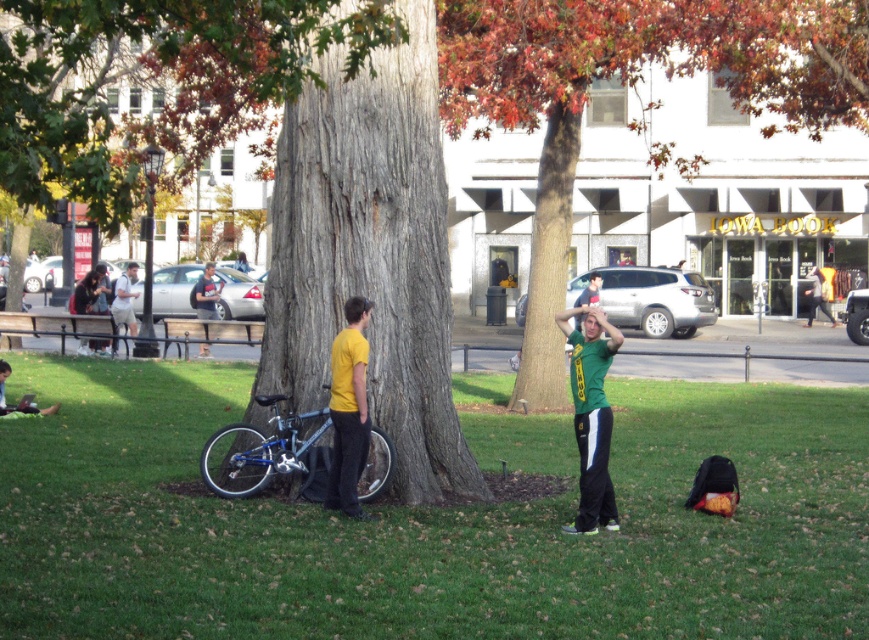
Question: Is shiny blue bicycle at center closer to the viewer compared to matte black shirt at center?

Choices:
 (A) yes
 (B) no

Answer: (A)

Question: Which object is closer to the camera taking this photo?

Choices:
 (A) gray textured tree trunk at center
 (B) green matte shirt at center
 (C) shiny blue bicycle at center
 (D) matte black shirt at center

Answer: (B)

Question: Which object appears farthest from the camera in this image?

Choices:
 (A) green matte shirt at center
 (B) light brown leather jacket at left
 (C) matte black shirt at center
 (D) shiny blue bicycle at center

Answer: (C)

Question: Where is yellow matte shirt at center located in relation to light brown leather jacket at left in the image?

Choices:
 (A) left
 (B) right

Answer: (B)

Question: Is gray textured tree trunk at center bigger than green matte shirt at center?

Choices:
 (A) yes
 (B) no

Answer: (A)

Question: Which is farther from the green matte shirt at center?

Choices:
 (A) gray textured tree trunk at center
 (B) shiny blue bicycle at center

Answer: (B)